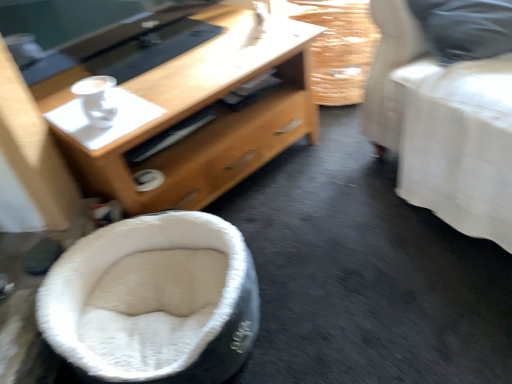
This screenshot has height=384, width=512. In order to click on free spot in front of wooden desk at center in this screenshot , I will do `click(313, 276)`.